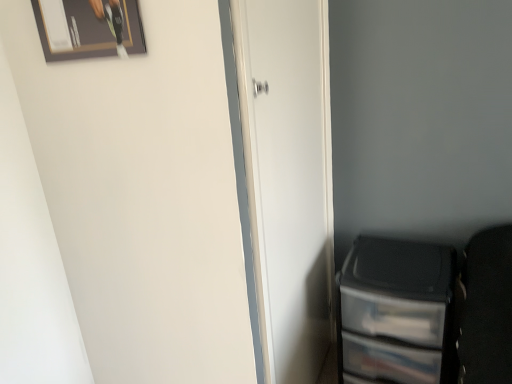
What do you see at coordinates (288, 178) in the screenshot? Image resolution: width=512 pixels, height=384 pixels. I see `white matte door at center` at bounding box center [288, 178].

Locate an element on the screen. Image resolution: width=512 pixels, height=384 pixels. white matte door at center is located at coordinates (288, 178).

This screenshot has height=384, width=512. Identify the location of wooden framed picture at upper left. (88, 28).

Looking at this image, how different are the orientations of white matte door at center and transparent plastic file cabinet at lower right in degrees?

93.2 degrees.

Between white matte door at center and transparent plastic file cabinet at lower right, which one has less height?

Standing shorter between the two is transparent plastic file cabinet at lower right.

Is white matte door at center far from transparent plastic file cabinet at lower right?

No.

Is the position of white matte door at center less distant than that of transparent plastic file cabinet at lower right?

Yes.

Looking at the image, does wooden framed picture at upper left seem bigger or smaller compared to transparent plastic file cabinet at lower right?

Clearly, wooden framed picture at upper left is smaller in size than transparent plastic file cabinet at lower right.

Where is `file cabinet behind the wooden framed picture at upper left`? The height and width of the screenshot is (384, 512). file cabinet behind the wooden framed picture at upper left is located at coordinates (397, 313).

From a real-world perspective, is wooden framed picture at upper left located higher than transparent plastic file cabinet at lower right?

Correct, in the physical world, wooden framed picture at upper left is higher than transparent plastic file cabinet at lower right.

From the image's perspective, is wooden framed picture at upper left on transparent plastic file cabinet at lower right?

Yes, from the image's perspective, wooden framed picture at upper left is on top of transparent plastic file cabinet at lower right.

Which object is further away from the camera, white matte door at center or wooden framed picture at upper left?

Positioned behind is white matte door at center.

Based on the photo, would you say white matte door at center is outside wooden framed picture at upper left?

Indeed, white matte door at center is completely outside wooden framed picture at upper left.

Where is `picture frame above the white matte door at center (from a real-world perspective)`? This screenshot has width=512, height=384. picture frame above the white matte door at center (from a real-world perspective) is located at coordinates (88, 28).

Based on their sizes in the image, would you say white matte door at center is bigger or smaller than wooden framed picture at upper left?

Considering their sizes, white matte door at center takes up more space than wooden framed picture at upper left.

Looking at this image, is transparent plastic file cabinet at lower right not close to wooden framed picture at upper left?

Yes, transparent plastic file cabinet at lower right and wooden framed picture at upper left are located far from each other.

Do you think transparent plastic file cabinet at lower right is within wooden framed picture at upper left, or outside of it?

transparent plastic file cabinet at lower right is not enclosed by wooden framed picture at upper left.

Is transparent plastic file cabinet at lower right oriented towards wooden framed picture at upper left?

No.

Between point (421, 358) and point (266, 253), which one is positioned in front?

Point (266, 253)

From a real-world perspective, relative to white matte door at center, is transparent plastic file cabinet at lower right vertically above or below?

Clearly, from a real-world perspective, transparent plastic file cabinet at lower right is below white matte door at center.

Which object is further away from the camera, transparent plastic file cabinet at lower right or white matte door at center?

transparent plastic file cabinet at lower right is further away from the camera.

Based on their positions, is transparent plastic file cabinet at lower right located to the left or right of white matte door at center?

Answer: Based on their positions, transparent plastic file cabinet at lower right is located to the right of white matte door at center.

Is wooden framed picture at upper left touching white matte door at center?

No, wooden framed picture at upper left is not in contact with white matte door at center.

Is white matte door at center inside wooden framed picture at upper left?

No, white matte door at center is located outside of wooden framed picture at upper left.

Between point (71, 41) and point (255, 144), which one is positioned in front?

The point (255, 144) is in front.

Identify the location of file cabinet lying below the white matte door at center (from the image's perspective). This screenshot has height=384, width=512. [397, 313].

Image resolution: width=512 pixels, height=384 pixels. Find the location of `picture frame above the transparent plastic file cabinet at lower right (from the image's perspective)`. picture frame above the transparent plastic file cabinet at lower right (from the image's perspective) is located at coordinates (88, 28).

Considering their positions, is transparent plastic file cabinet at lower right positioned further to wooden framed picture at upper left than white matte door at center?

transparent plastic file cabinet at lower right lies further to wooden framed picture at upper left than the other object.

Based on their spatial positions, is transparent plastic file cabinet at lower right or wooden framed picture at upper left further from white matte door at center?

wooden framed picture at upper left is positioned further to the anchor white matte door at center.

In the scene shown: Based on their spatial positions, is wooden framed picture at upper left or transparent plastic file cabinet at lower right further from white matte door at center?

The object further to white matte door at center is wooden framed picture at upper left.

Considering their positions, is wooden framed picture at upper left positioned closer to transparent plastic file cabinet at lower right than white matte door at center?

white matte door at center lies closer to transparent plastic file cabinet at lower right than the other object.

Based on their spatial positions, is white matte door at center or wooden framed picture at upper left further from transparent plastic file cabinet at lower right?

Based on the image, wooden framed picture at upper left appears to be further to transparent plastic file cabinet at lower right.

When comparing their distances from wooden framed picture at upper left, does white matte door at center or transparent plastic file cabinet at lower right seem further?

transparent plastic file cabinet at lower right lies further to wooden framed picture at upper left than the other object.

You are a GUI agent. You are given a task and a screenshot of the screen. Output one action in this format:
    pyautogui.click(x=<x>, y=<y>)
    Task: Click on the door that lies between wooden framed picture at upper left and transparent plastic file cabinet at lower right from top to bottom
    This screenshot has width=512, height=384.
    Given the screenshot: What is the action you would take?
    pyautogui.click(x=288, y=178)